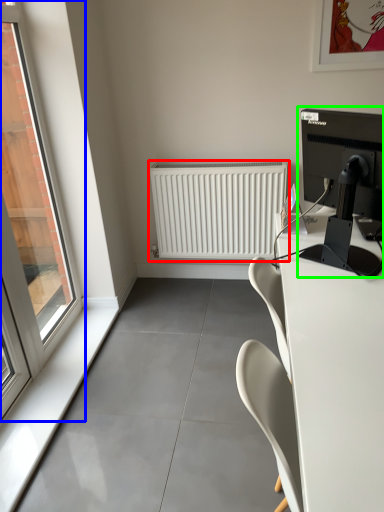
Question: Which is farther away from radiator (highlighted by a red box)? window (highlighted by a blue box) or computer monitor (highlighted by a green box)?

Choices:
 (A) window
 (B) computer monitor

Answer: (B)